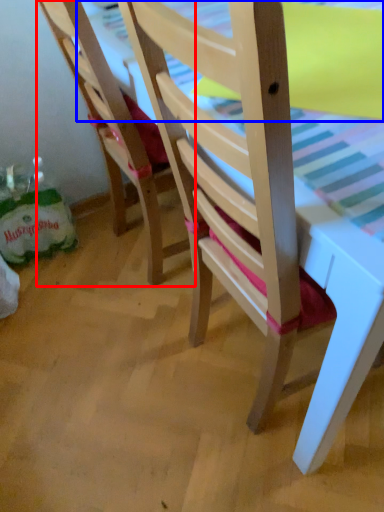
Question: Which object is further to the camera taking this photo, chair (highlighted by a red box) or table top (highlighted by a blue box)?

Choices:
 (A) chair
 (B) table top

Answer: (A)